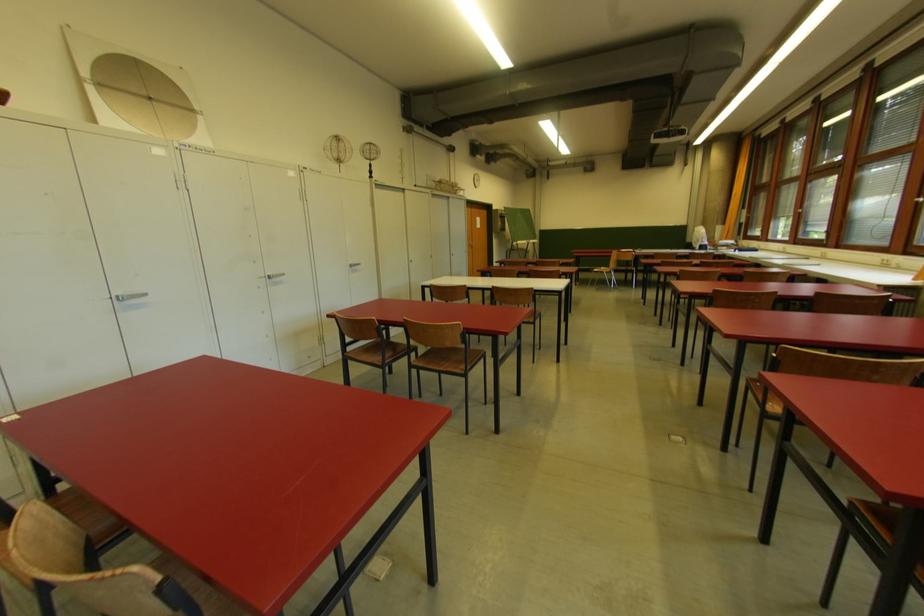
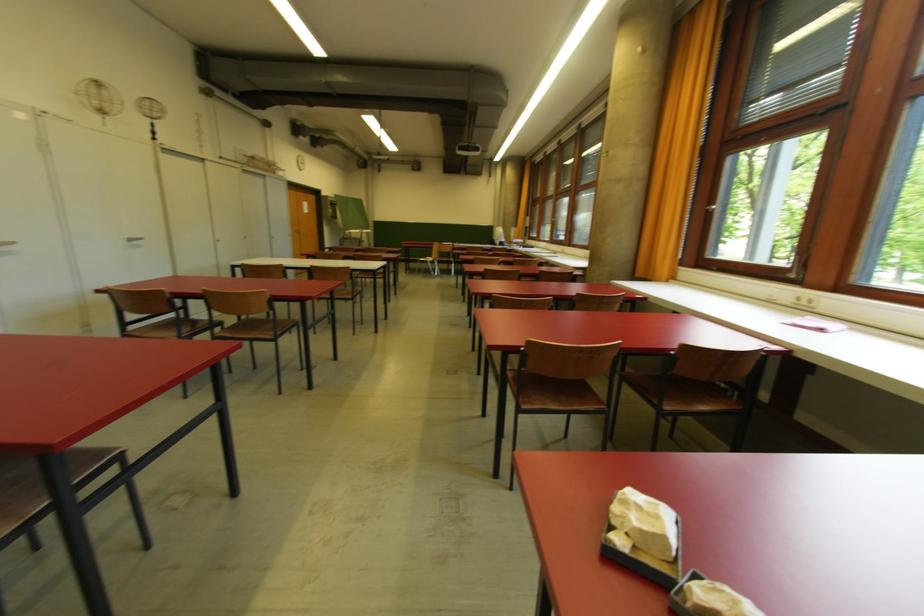
Find the pixel in the second image that matches point (414, 264) in the first image.

(221, 243)